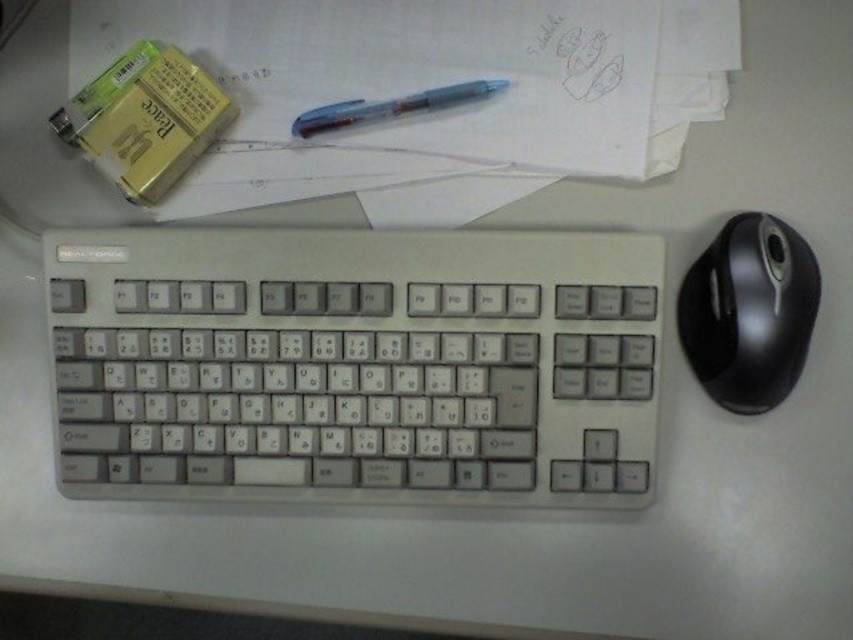
Question: Is black rubberized mouse at right thinner than gold metallic battery at upper left?

Choices:
 (A) no
 (B) yes

Answer: (B)

Question: Is white paper at upper center wider than black rubberized mouse at right?

Choices:
 (A) no
 (B) yes

Answer: (B)

Question: Does black rubberized mouse at right have a greater width compared to translucent plastic pen at center?

Choices:
 (A) yes
 (B) no

Answer: (B)

Question: Which point is farther to the camera?

Choices:
 (A) black rubberized mouse at right
 (B) gold metallic battery at upper left
 (C) white paper at upper center

Answer: (C)

Question: Which object is the closest to the black rubberized mouse at right?

Choices:
 (A) white paper at upper center
 (B) white plastic keyboard at center
 (C) gold metallic battery at upper left
 (D) translucent plastic pen at center

Answer: (B)

Question: Which point is farther to the camera?

Choices:
 (A) (410, 384)
 (B) (614, 172)
 (C) (456, 97)

Answer: (B)